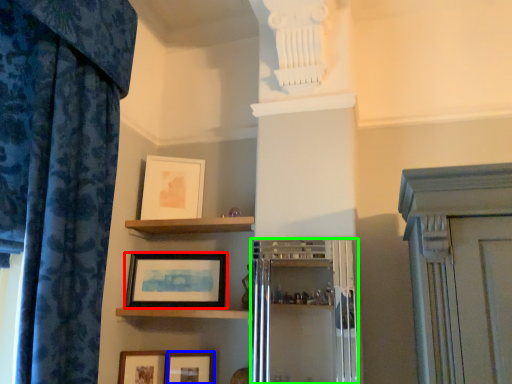
Question: Which object is the closest to the picture frame (highlighted by a red box)? Choose among these: picture frame (highlighted by a blue box) or cabinetry (highlighted by a green box).

Choices:
 (A) picture frame
 (B) cabinetry

Answer: (A)